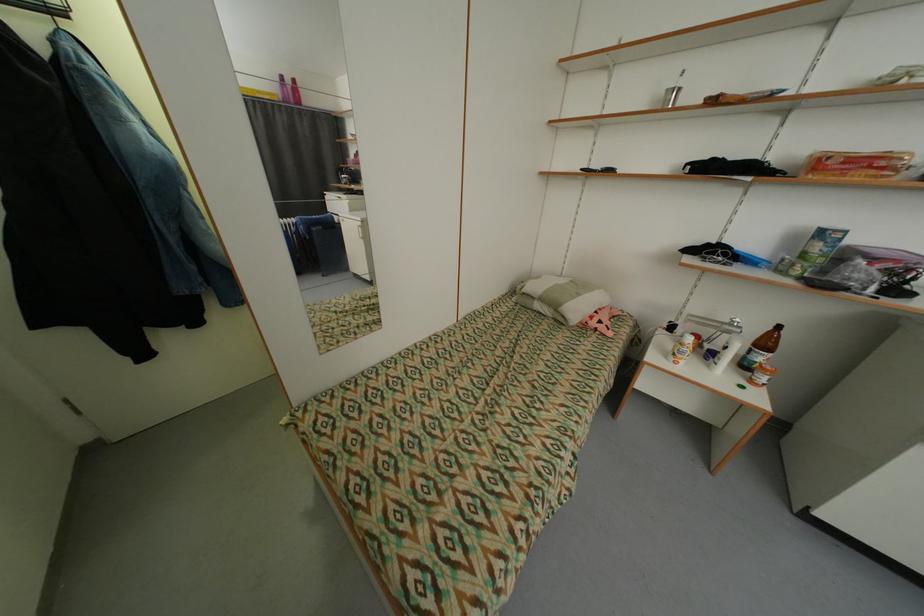
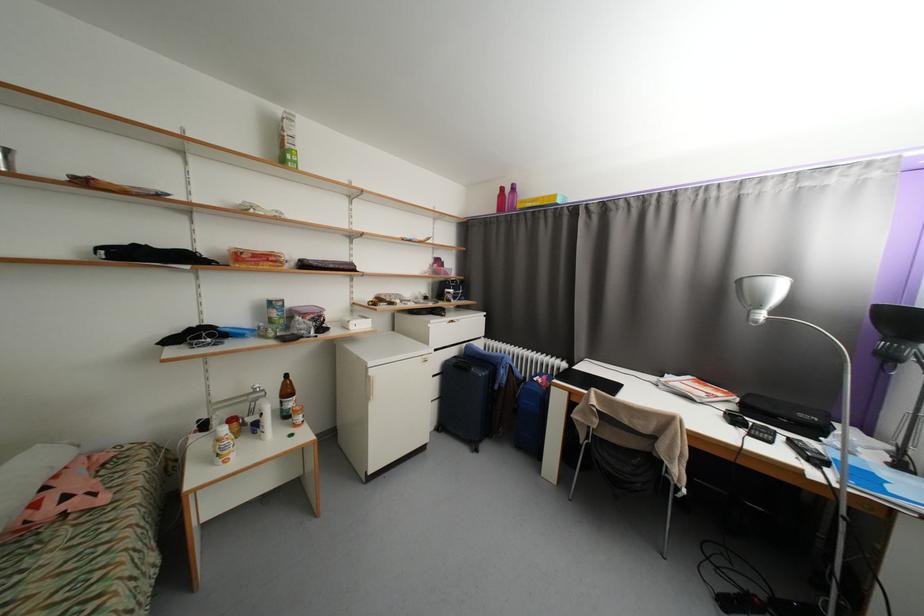
Find the pixel in the second image that matches (x=686, y=331) in the first image.

(222, 424)